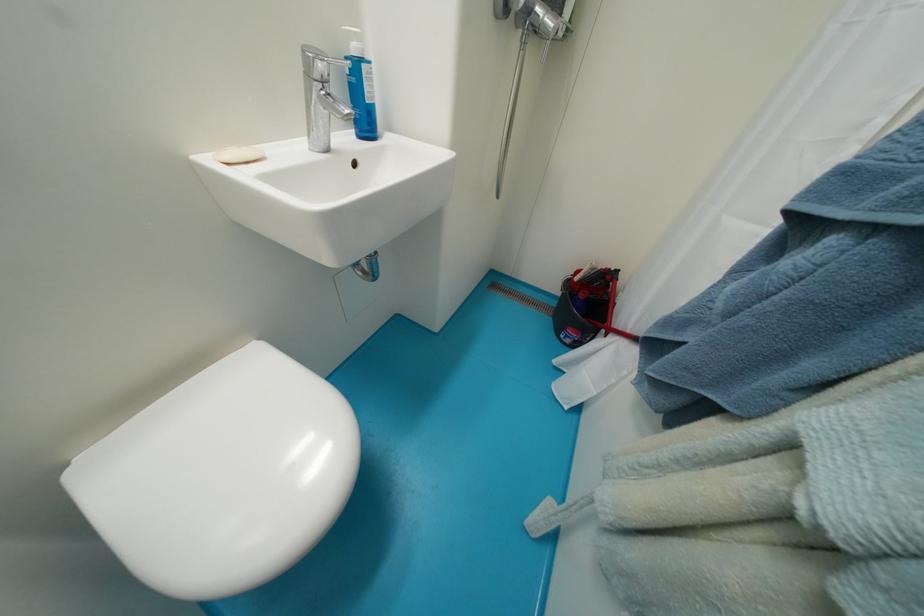
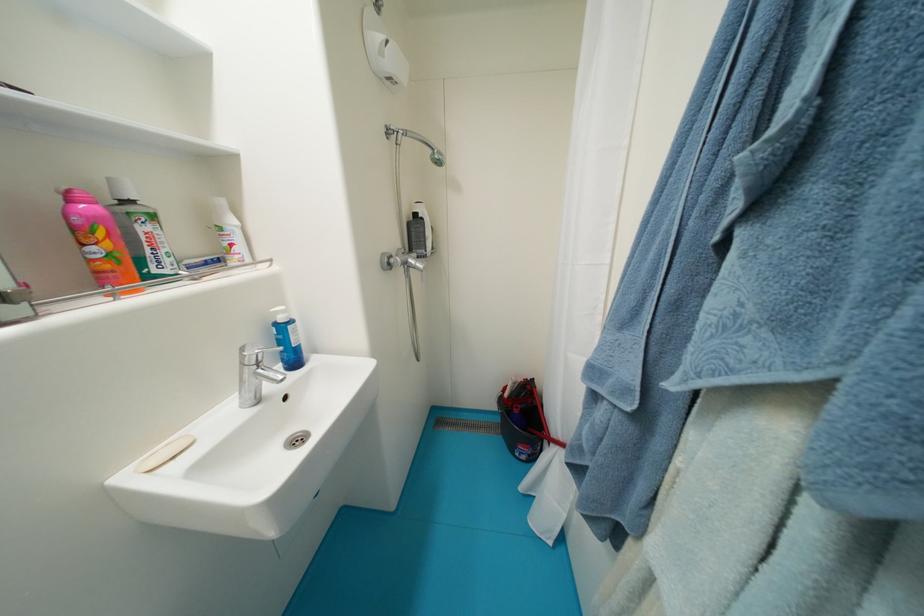
How did the camera likely rotate?

The camera rotated toward right-up.